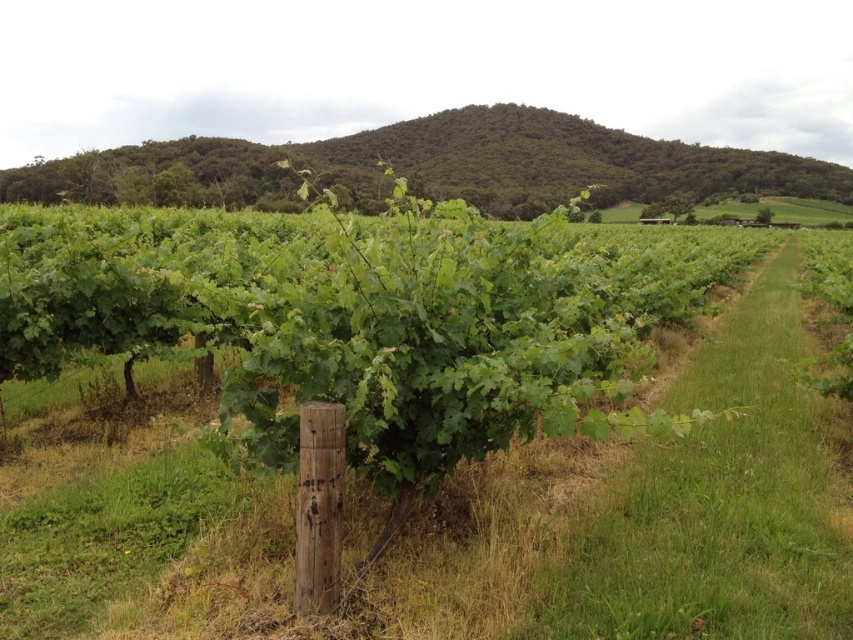
Consider the image. You are standing in the vineyard and want to walk from the point closer to you to the point further away. Which path would you take between the two points, point (813,515) and point (444,140)?

The point closer to the viewer is point (813,515), so you should walk from point (813,515) to point (444,140) to reach the further point.

You are standing at the entrance of the vineyard and see the point marked at coordinates (x=473, y=518). What does this point represent in the scene?

The point at coordinates (x=473, y=518) represents the green leafy vines at center.